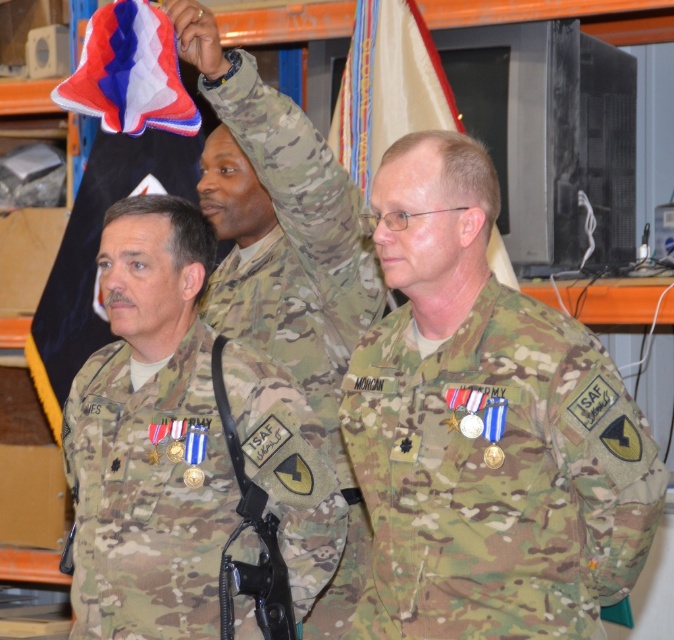
You are a photographer at the ceremony and need to capture both the red and white fabric flag at upper left and the yellow fabric flag at upper center in a single frame. Which flag should you focus on first to ensure both are in the frame?

You should focus on the red and white fabric flag at upper left first because it is larger and will require more space in the frame, ensuring the smaller yellow fabric flag at upper center can fit alongside.

You are an observer in a military ceremony. You notice two flags displayed in the scene. Which flag is positioned lower between the red and white fabric flag at upper left and the yellow fabric flag at upper center?

The red and white fabric flag at upper left is positioned lower than the yellow fabric flag at upper center.